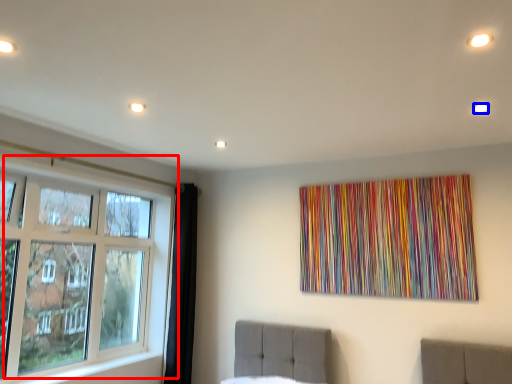
Question: Among these objects, which one is farthest to the camera, window (highlighted by a red box) or light (highlighted by a blue box)?

Choices:
 (A) window
 (B) light

Answer: (A)